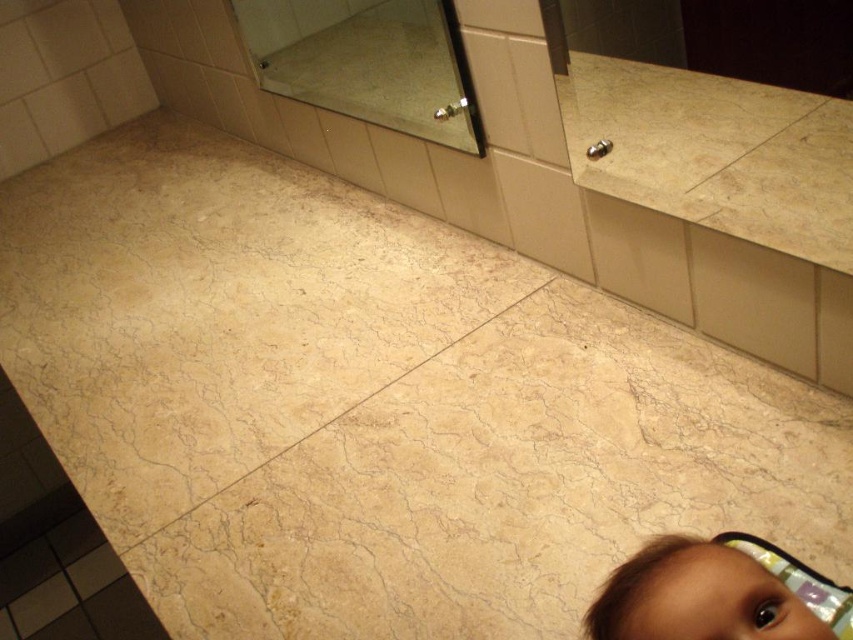
Does clear glass mirror at upper center have a lesser width compared to brown hair at lower right?

Incorrect, clear glass mirror at upper center's width is not less than brown hair at lower right's.

Does clear glass mirror at upper center appear on the right side of brown hair at lower right?

In fact, clear glass mirror at upper center is to the left of brown hair at lower right.

You are a GUI agent. You are given a task and a screenshot of the screen. Output one action in this format:
    pyautogui.click(x=<x>, y=<y>)
    Task: Click on the clear glass mirror at upper center
    This screenshot has width=853, height=640.
    Given the screenshot: What is the action you would take?
    pyautogui.click(x=367, y=61)

The height and width of the screenshot is (640, 853). I want to click on clear glass mirror at upper center, so click(367, 61).